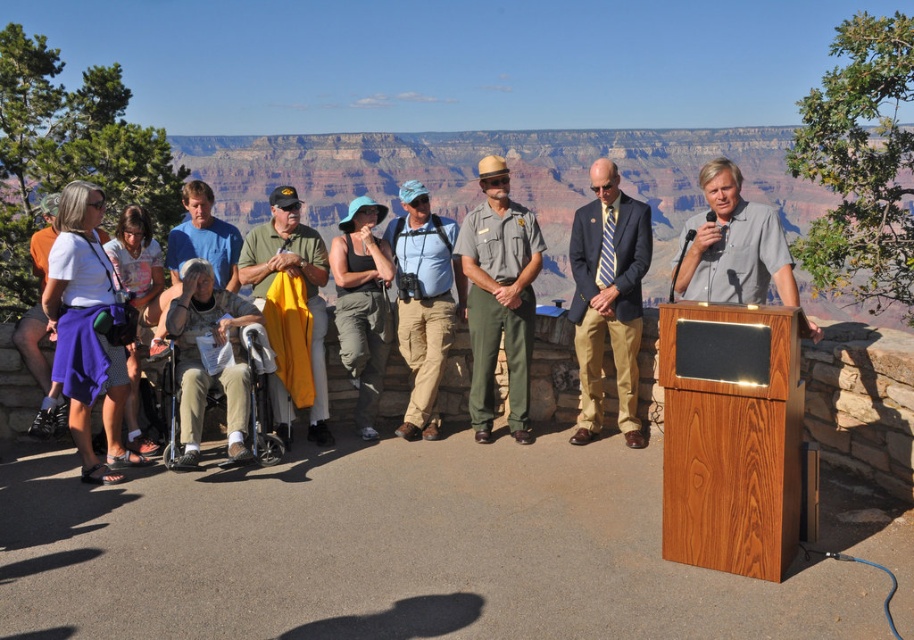
Question: Which is farther from the khaki cotton pants at center?

Choices:
 (A) gray fabric shirt at center
 (B) green fabric jacket at center
 (C) navy blue suit at center
 (D) green uniform pants at center

Answer: (A)

Question: Does navy blue suit at center come behind green uniform pants at center?

Choices:
 (A) no
 (B) yes

Answer: (A)

Question: Among these points, which one is nearest to the camera?

Choices:
 (A) (326, 268)
 (B) (647, 234)
 (C) (734, 264)

Answer: (C)

Question: Can you confirm if navy blue suit at center is positioned above blue cotton shirt at center?

Choices:
 (A) no
 (B) yes

Answer: (A)

Question: Can you confirm if green uniform pants at center is positioned to the right of khaki cotton pants at center?

Choices:
 (A) no
 (B) yes

Answer: (B)

Question: Which point is closer to the camera?

Choices:
 (A) gray fabric shirt at center
 (B) navy blue suit at center

Answer: (A)